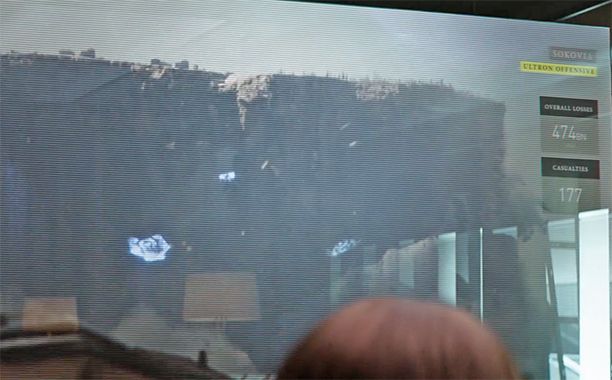
Find the location of a particular element. lamp shade is located at coordinates (237, 300).